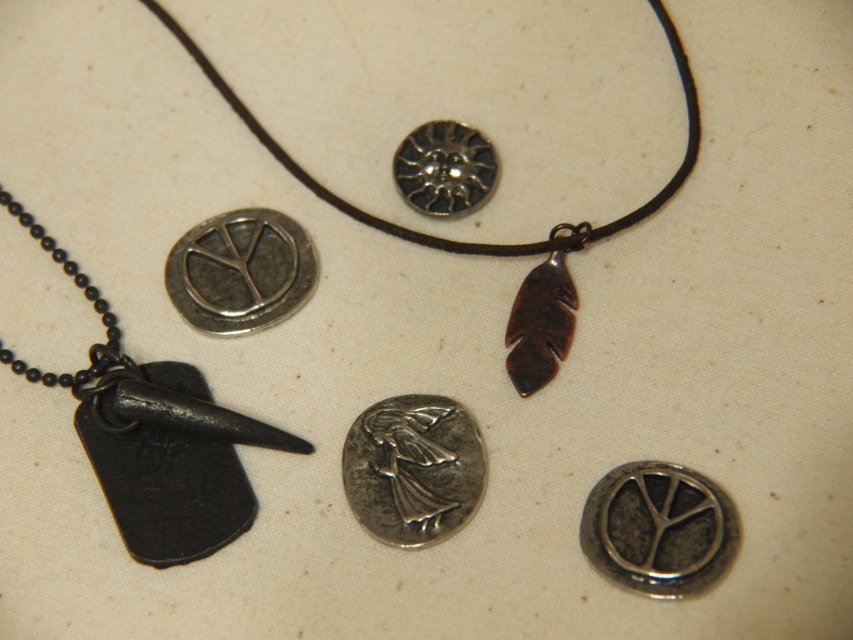
You are organizing a display of jewelry items on a table. You have the silver metallic coin at center and the antique silver pendant at upper center. Based on their positions, which item is closer to the bottom edge of the table?

The silver metallic coin at center is closer to the bottom edge of the table because it is positioned below the antique silver pendant at upper center.

You are organizing the jewelry items on the light surface. The silver metallic coin at center is placed at coordinates point 0.733, 0.485. If you want to move it closer to the necklace with a black cord at top right corner, which direction should you move it?

To move the silver metallic coin at center closer to the necklace with a black cord at top right corner, you should move it towards the top right direction since the coin is currently located at point (413, 468) and the necklace is at the top right corner of the image.

You are arranging a display of jewelry items on a table. You have two points marked on the table where you need to place items. The first point is at coordinate point (699, 506) and the second point is at coordinate point (234, 280). If you place an item at each point, which point will have its item closer to the viewer?

The item placed at point (699, 506) will be closer to the viewer because point (699, 506) is in front of point (234, 280).